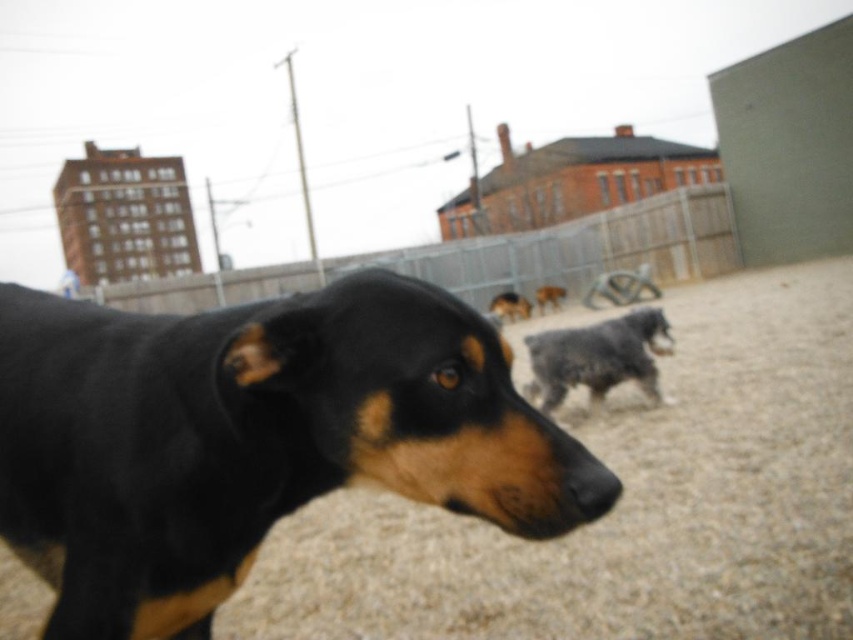
Who is positioned more to the right, black fur dog at center or gray metal fence at upper center?

gray metal fence at upper center

Between point (12, 369) and point (357, 262), which one is positioned behind?

The point (357, 262) is more distant.

I want to click on black fur dog at center, so click(253, 438).

Is the position of black fur dog at center less distant than that of gray woolen sweater at center?

Yes.

Does black fur dog at center appear on the left side of gray woolen sweater at center?

Correct, you'll find black fur dog at center to the left of gray woolen sweater at center.

I want to click on black fur dog at center, so click(253, 438).

Which is above, black fur dog at center or fuzzy gray dog at center?

Positioned higher is black fur dog at center.

Which is behind, point (131, 545) or point (558, 353)?

The point (558, 353) is behind.

I want to click on black fur dog at center, so click(x=253, y=438).